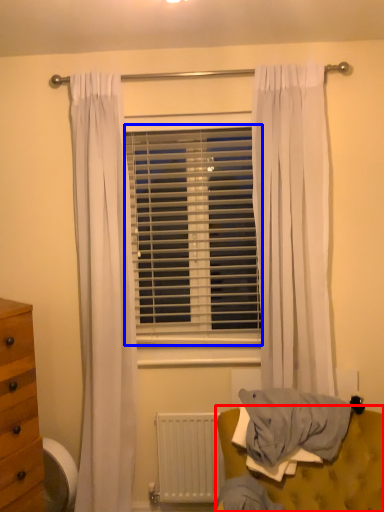
Question: Which point is closer to the camera, furniture (highlighted by a red box) or window blind (highlighted by a blue box)?

Choices:
 (A) furniture
 (B) window blind

Answer: (A)